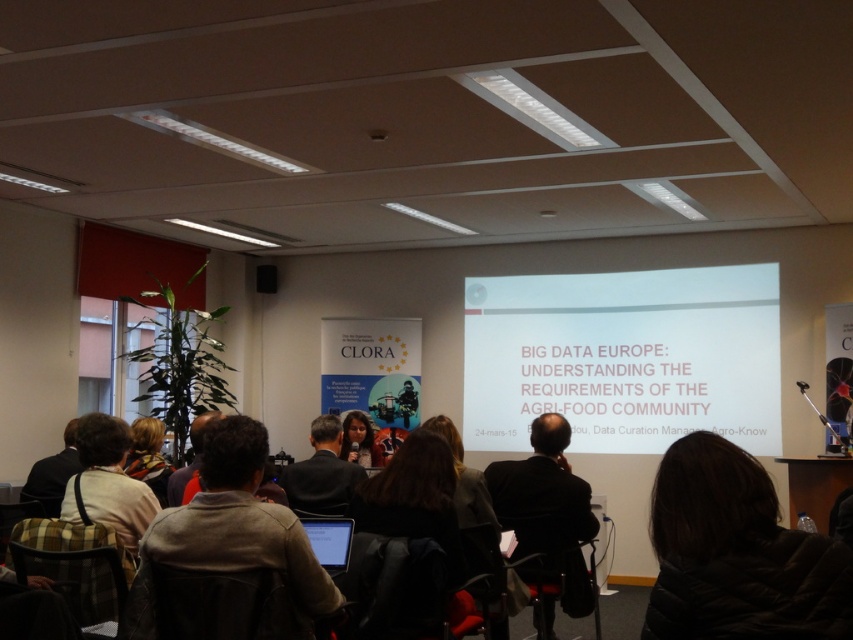
Question: Which object appears farthest from the camera in this image?

Choices:
 (A) dark suit jacket at center
 (B) matte black laptop at lower center
 (C) white matte projector screen at center

Answer: (C)

Question: Which object appears closest to the camera in this image?

Choices:
 (A) dark suit jacket at center
 (B) brown leather jacket at lower center
 (C) matte black jacket at center
 (D) white matte projector screen at center

Answer: (B)

Question: Based on their relative distances, which object is nearer to the brown leather jacket at lower center?

Choices:
 (A) light brown leather jacket at lower left
 (B) dark suit jacket at center
 (C) multicolored scarf at center
 (D) dark brown leather jacket at lower left

Answer: (A)

Question: Can you confirm if brown leather jacket at lower center is positioned to the right of dark gray suit at center?

Choices:
 (A) yes
 (B) no

Answer: (A)

Question: Can you confirm if brown leather jacket at lower center is thinner than dark gray suit at center?

Choices:
 (A) yes
 (B) no

Answer: (B)

Question: Can you confirm if black puffer jacket at lower right is positioned above light brown leather jacket at lower left?

Choices:
 (A) yes
 (B) no

Answer: (A)